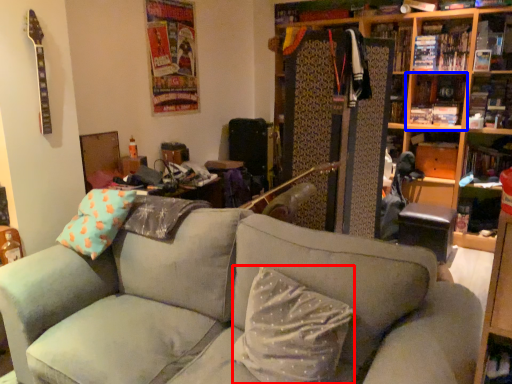
Question: Which object appears farthest to the camera in this image, pillow (highlighted by a red box) or shelf (highlighted by a blue box)?

Choices:
 (A) pillow
 (B) shelf

Answer: (B)